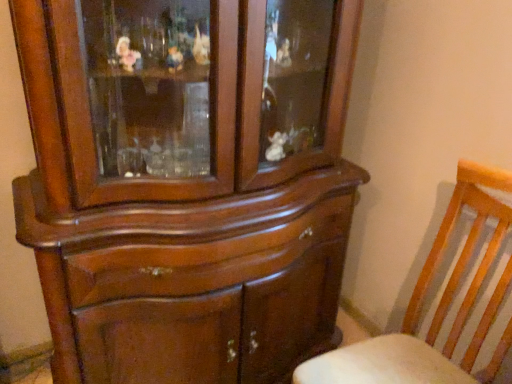
What do you see at coordinates (437, 308) in the screenshot?
I see `light brown wooden chair at right` at bounding box center [437, 308].

Where is `light brown wooden chair at right`? The image size is (512, 384). light brown wooden chair at right is located at coordinates (437, 308).

The image size is (512, 384). I want to click on light brown wooden chair at right, so click(x=437, y=308).